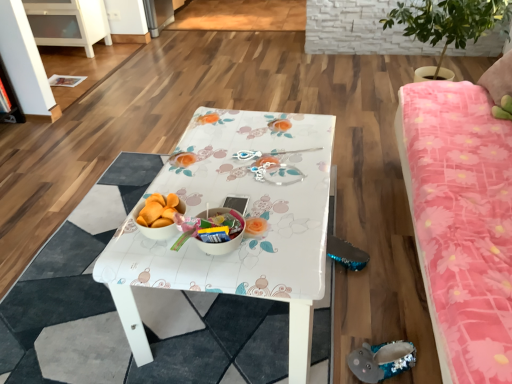
Find the location of a particular element. The image size is (512, 384). free area behind white glossy bowl at center is located at coordinates (226, 195).